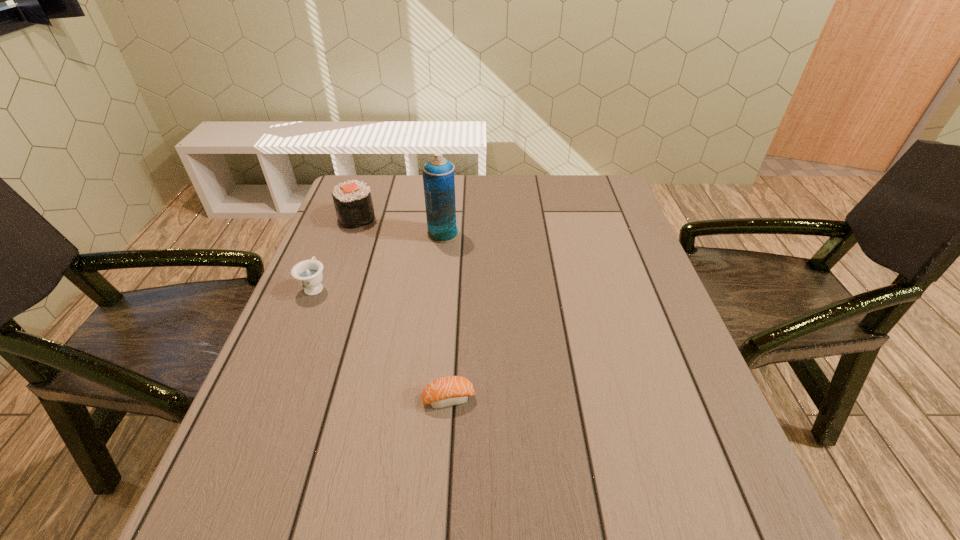
I want to click on blank space located 0.320m on the side of the teacup with the handle, so click(348, 204).

This screenshot has height=540, width=960. Find the location of `free space located on the side of the teacup with the handle`. free space located on the side of the teacup with the handle is located at coordinates (349, 201).

Locate an element on the screen. This screenshot has width=960, height=540. vacant position located on the right of the nearer sushi is located at coordinates (559, 398).

I want to click on object located in the far edge section of the desktop, so click(353, 203).

This screenshot has width=960, height=540. Identify the location of sushi at the left edge. (353, 203).

At what (x,y) coordinates should I click in order to perform the action: click on teacup present at the left edge. Please return your answer as a coordinate pair (x, y). The image size is (960, 540). Looking at the image, I should click on (308, 273).

Where is `object present at the far left corner`? This screenshot has height=540, width=960. object present at the far left corner is located at coordinates (353, 203).

Image resolution: width=960 pixels, height=540 pixels. I want to click on free space at the far edge of the desktop, so click(503, 187).

Locate an element on the screen. This screenshot has height=540, width=960. free space at the near edge is located at coordinates (592, 498).

Find the location of `free location at the left edge of the desktop`. free location at the left edge of the desktop is located at coordinates (332, 345).